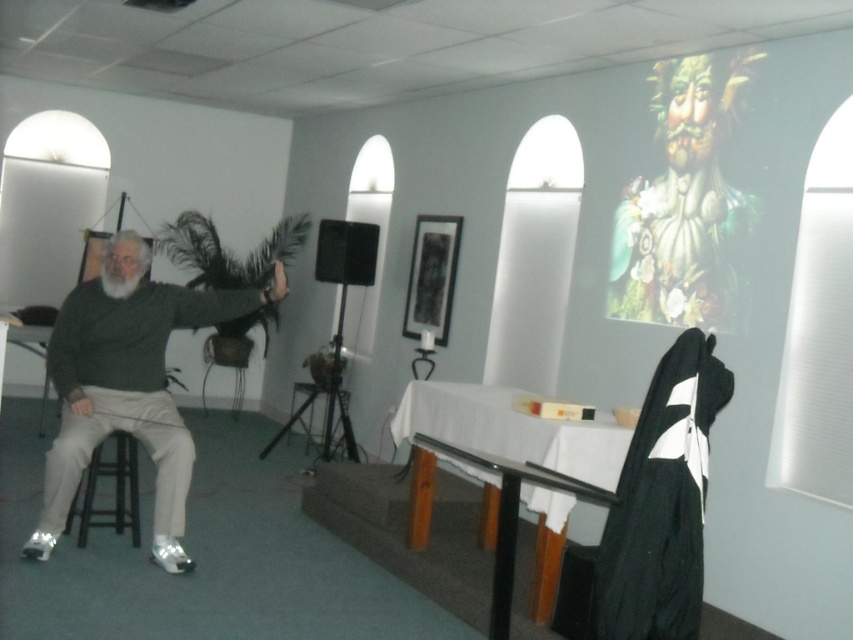
Question: Can you confirm if matte green sweater at left is bigger than black matte robe at right?

Choices:
 (A) no
 (B) yes

Answer: (B)

Question: Does matte green sweater at left have a lesser width compared to wooden stool at left?

Choices:
 (A) yes
 (B) no

Answer: (B)

Question: Which of these objects is positioned closest to the wooden stool at left?

Choices:
 (A) black glass table at center
 (B) black matte robe at right

Answer: (A)

Question: Is the position of black matte robe at right more distant than that of wooden stool at left?

Choices:
 (A) yes
 (B) no

Answer: (B)

Question: Which object appears closest to the camera in this image?

Choices:
 (A) black matte robe at right
 (B) wooden stool at left
 (C) black glass table at center

Answer: (A)

Question: Estimate the real-world distances between objects in this image. Which object is closer to the black matte robe at right?

Choices:
 (A) wooden stool at left
 (B) matte green sweater at left

Answer: (B)